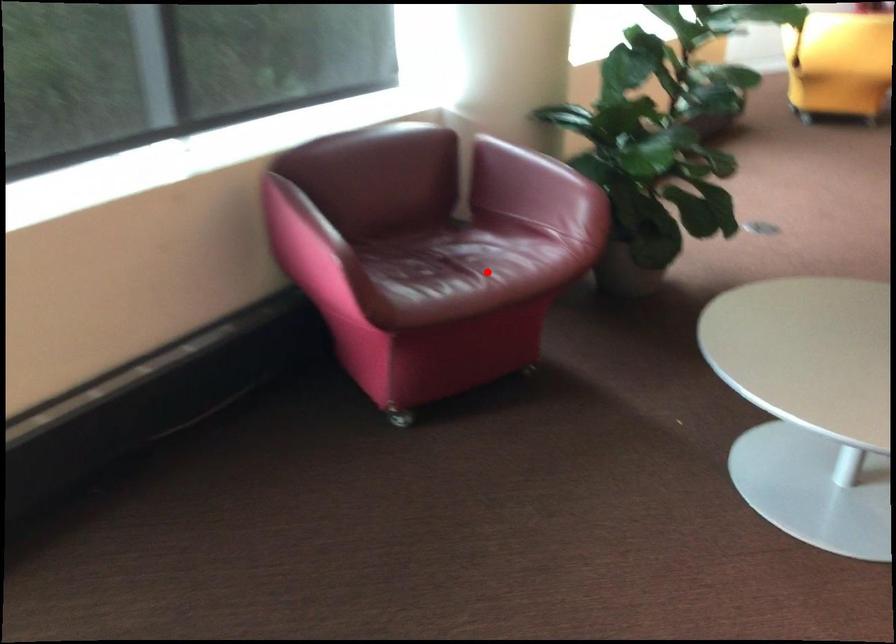
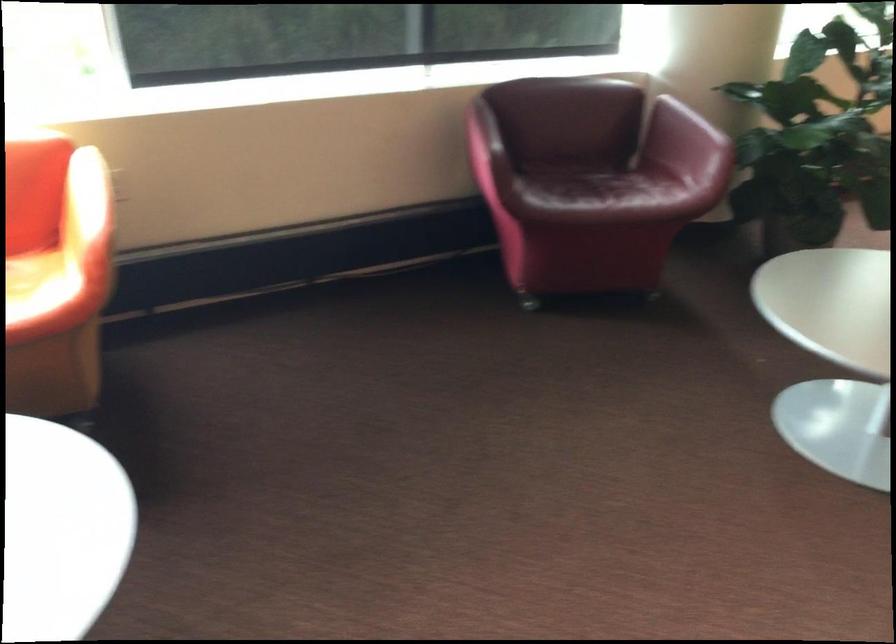
Question: I am providing you with two images of the same scene from different viewpoints. In image1, a red point is highlighted. Considering the same 3D point in image2, which of the following is correct?

Choices:
 (A) It is closer
 (B) It is farther

Answer: (B)